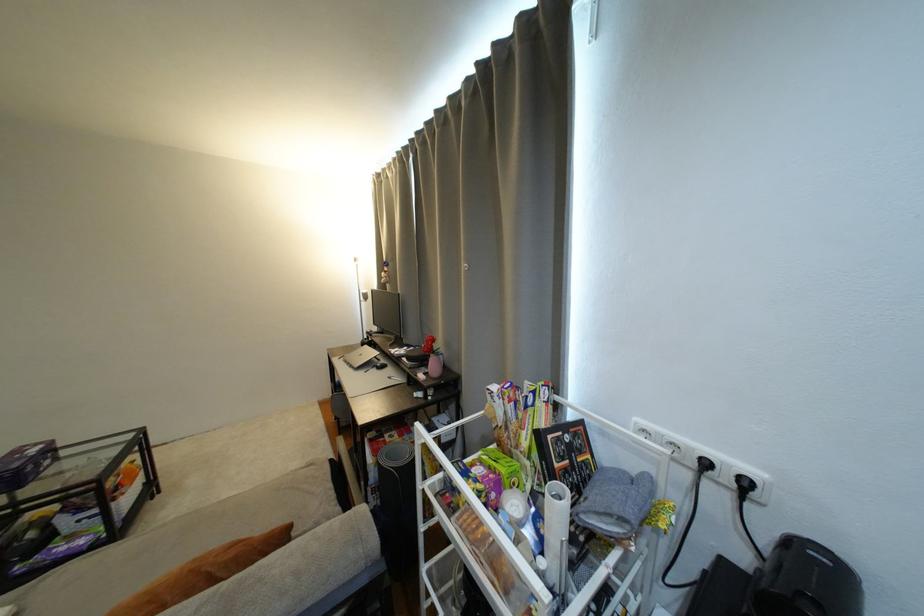
Where would you push the white cart handle? Please return your answer as a coordinate pair (x, y).

(600, 419)